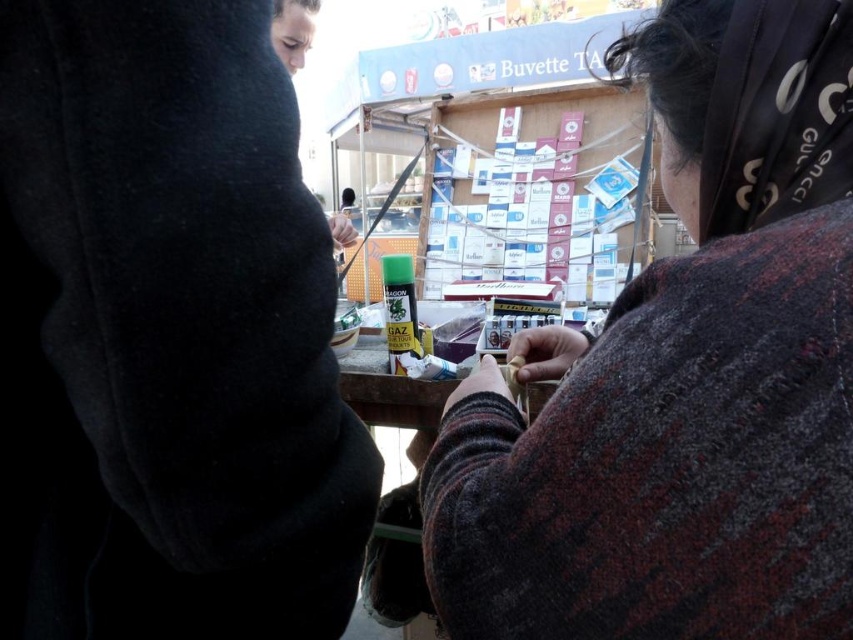
Does knitted wool sweater at center come behind black fabric headscarf at upper right?

No, it is not.

Which is behind, point (787, 12) or point (796, 20)?

Positioned behind is point (787, 12).

At what (x,y) coordinates should I click in order to perform the action: click on knitted wool sweater at center. Please return your answer as a coordinate pair (x, y). This screenshot has width=853, height=640. Looking at the image, I should click on (683, 376).

Is black fleece sweatshirt at left above knitted wool sweater at center?

Actually, black fleece sweatshirt at left is below knitted wool sweater at center.

Is black fleece sweatshirt at left smaller than knitted wool sweater at center?

Indeed, black fleece sweatshirt at left has a smaller size compared to knitted wool sweater at center.

Which is in front, point (73, 452) or point (817, 445)?

Positioned in front is point (817, 445).

This screenshot has width=853, height=640. In order to click on black fleece sweatshirt at left in this screenshot , I will do `click(166, 336)`.

How distant is black fleece sweatshirt at left from black fabric headscarf at upper right?

black fleece sweatshirt at left is 19.20 inches away from black fabric headscarf at upper right.

Is black fleece sweatshirt at left above black fabric headscarf at upper right?

Actually, black fleece sweatshirt at left is below black fabric headscarf at upper right.

Which is behind, point (213, 604) or point (788, 118)?

The point (788, 118) is behind.

Find the location of `black fleece sweatshirt at left`. black fleece sweatshirt at left is located at coordinates (166, 336).